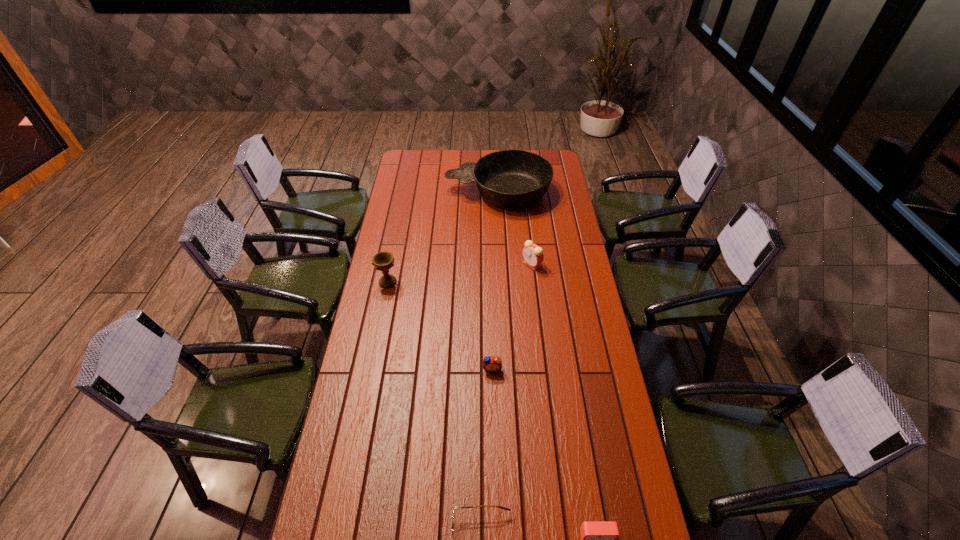
This screenshot has height=540, width=960. Identify the location of free space at the left edge. (370, 320).

Where is `vacant area at the right edge`? This screenshot has height=540, width=960. vacant area at the right edge is located at coordinates (607, 381).

At what (x,y) coordinates should I click in order to perform the action: click on vacant area between the fourth shortest object and the farthest object. Please return your answer as a coordinate pair (x, y). Looking at the image, I should click on (515, 228).

The image size is (960, 540). Find the location of `blank region between the farthest alarm clock and the leftmost object`. blank region between the farthest alarm clock and the leftmost object is located at coordinates (460, 273).

You are a GUI agent. You are given a task and a screenshot of the screen. Output one action in this format:
    pyautogui.click(x=<x>, y=<y>)
    Task: Click on the vacant region between the third farthest object and the tallest alarm clock
    The width and height of the screenshot is (960, 540).
    Given the screenshot: What is the action you would take?
    pyautogui.click(x=460, y=273)

Identify the location of object that can be found as the closest to the fifth tallest object. The image size is (960, 540). (459, 507).

Locate which object ranks fifth in proximity to the frying pan. Please provide its 2D coordinates. Your answer should be formatted as a tuple, i.e. [(x, y)], where the tuple contains the x and y coordinates of a point satisfying the conditions above.

[(598, 538)]

Choose which alarm clock is the third nearest neighbor to the shortest object. Please provide its 2D coordinates. Your answer should be formatted as a tuple, i.e. [(x, y)], where the tuple contains the x and y coordinates of a point satisfying the conditions above.

[(533, 255)]

Find the location of a particular element. The width and height of the screenshot is (960, 540). the closest alarm clock to the fourth shortest object is located at coordinates (492, 364).